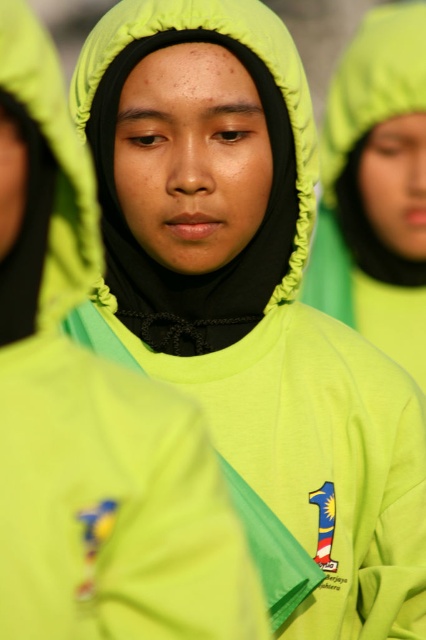
Based on the scene description, which hood is positioned lower in the image, the lime green fabric hood at left or the matte green hood at center?

The lime green fabric hood at left is positioned below the matte green hood at center, so it is lower in the image.

You are standing in front of the group of individuals wearing matching outfits. There is a point at coordinates point (17, 48). Can you reach this point without moving your feet?

The point at coordinates point (17, 48) is 1.38 meters away from the viewer, so yes, you can reach it without moving your feet since it is within arm reach.